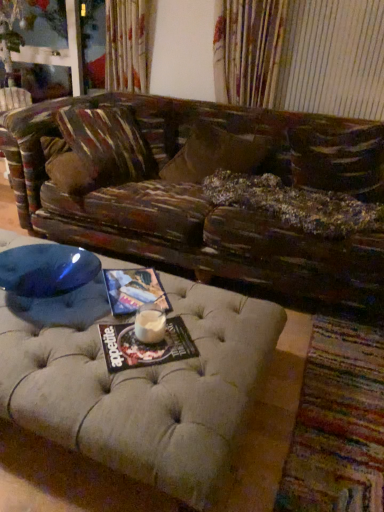
Question: From a real-world perspective, is distressed wood studio couch at center above or below multicolored woven mat at lower right?

Choices:
 (A) above
 (B) below

Answer: (B)

Question: Does point (x=238, y=354) appear closer or farther from the camera than point (x=322, y=443)?

Choices:
 (A) farther
 (B) closer

Answer: (B)

Question: Estimate the real-world distances between objects in this image. Which object is closer to the fuzzy brown pillow at center?

Choices:
 (A) white frothy liquid at center
 (B) distressed wood studio couch at center
 (C) matte paper magazine at center, which is the second magazine from back to front
 (D) matte paper magazine at center, acting as the 2th magazine starting from the front
 (E) wooden swivel chair at left

Answer: (D)

Question: Estimate the real-world distances between objects in this image. Which object is farther from the fuzzy brown pillow at center?

Choices:
 (A) distressed wood studio couch at center
 (B) white frothy liquid at center
 (C) multicolored woven mat at lower right
 (D) matte paper magazine at center, which is counted as the first magazine, starting from the top
 (E) matte paper magazine at center, the second magazine viewed from the top

Answer: (E)